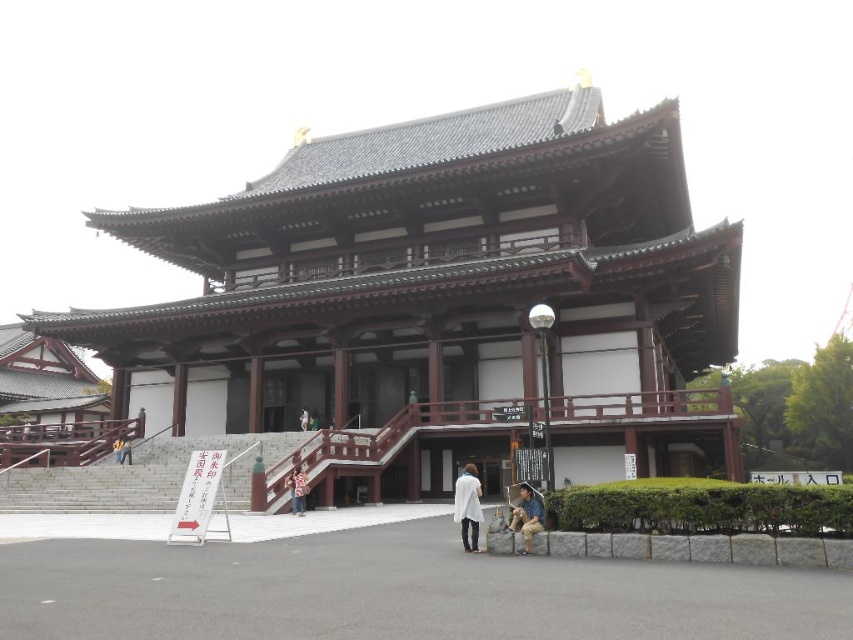
You are standing in front of the traditional Japanese building and see a white matte coat at center. Where is the white matte coat located in relation to the building?

The white matte coat at center is located at the coordinates point (467, 506) in the image.

You are standing in front of the traditional Japanese building and see both the white matte coat at center and the light brown wooden sign at center. Which object is nearer to you?

The white matte coat at center is closer to the viewer than the light brown wooden sign at center.